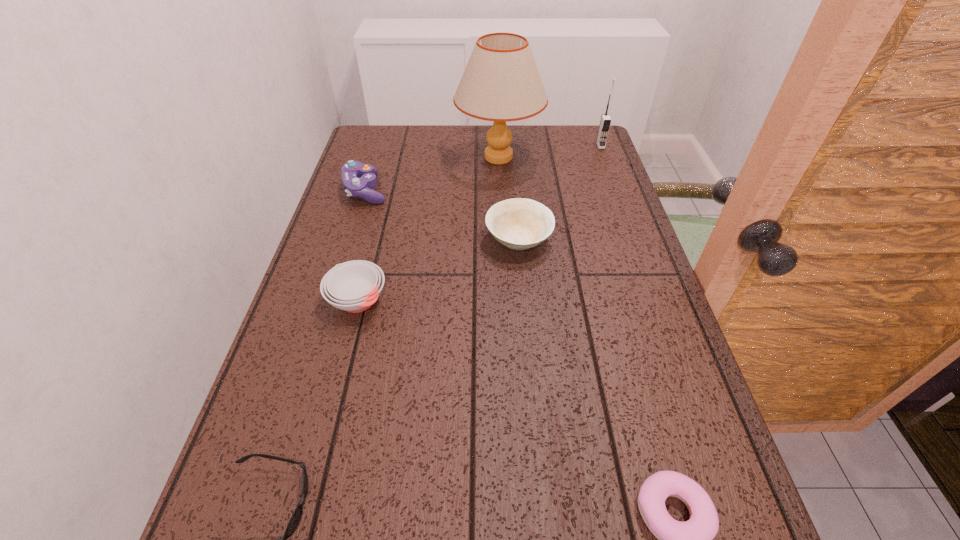
In the image, there is a desktop. What are the coordinates of `vacant space at the far left corner` in the screenshot? It's located at (369, 135).

I want to click on free space at the far right corner of the desktop, so click(569, 148).

You are a GUI agent. You are given a task and a screenshot of the screen. Output one action in this format:
    pyautogui.click(x=<x>, y=<y>)
    Task: Click on the free spot between the control and the bowl
    This screenshot has height=540, width=960.
    Given the screenshot: What is the action you would take?
    pyautogui.click(x=443, y=215)

The width and height of the screenshot is (960, 540). What are the coordinates of `free point between the second tallest object and the tallest object` in the screenshot? It's located at (549, 151).

I want to click on free space between the sixth shortest object and the control, so click(483, 168).

You are a GUI agent. You are given a task and a screenshot of the screen. Output one action in this format:
    pyautogui.click(x=<x>, y=<y>)
    Task: Click on the free spot between the lampshade and the rightmost object
    Image resolution: width=960 pixels, height=540 pixels.
    Given the screenshot: What is the action you would take?
    pyautogui.click(x=549, y=151)

Where is `empty space that is in between the sixth shortest object and the lampshade`? This screenshot has width=960, height=540. empty space that is in between the sixth shortest object and the lampshade is located at coordinates (549, 151).

Identify which object is located as the fourth nearest to the fourth nearest object. Please provide its 2D coordinates. Your answer should be formatted as a tuple, i.e. [(x, y)], where the tuple contains the x and y coordinates of a point satisfying the conditions above.

[(605, 122)]

Find the location of a particular element. This screenshot has width=960, height=540. the closest object to the pastry is located at coordinates (518, 223).